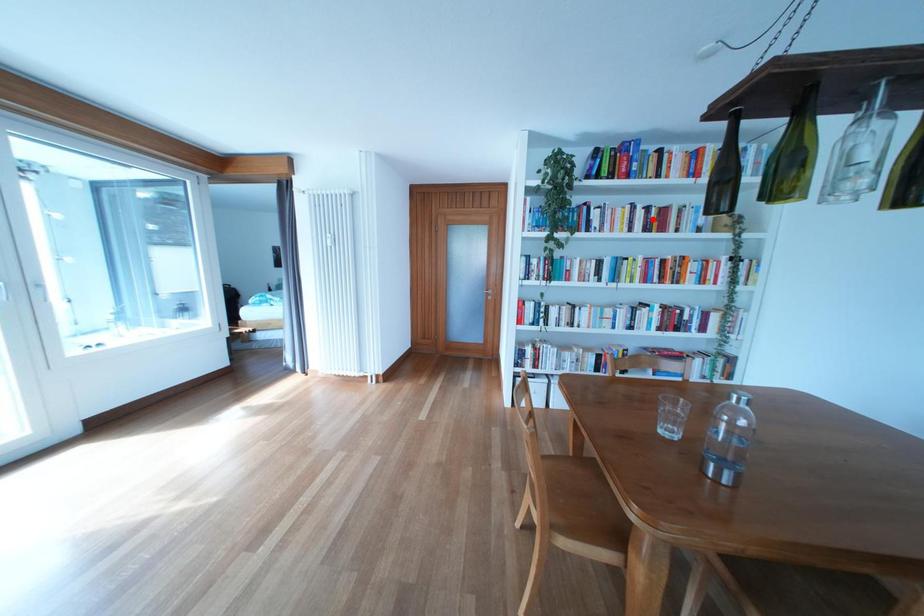
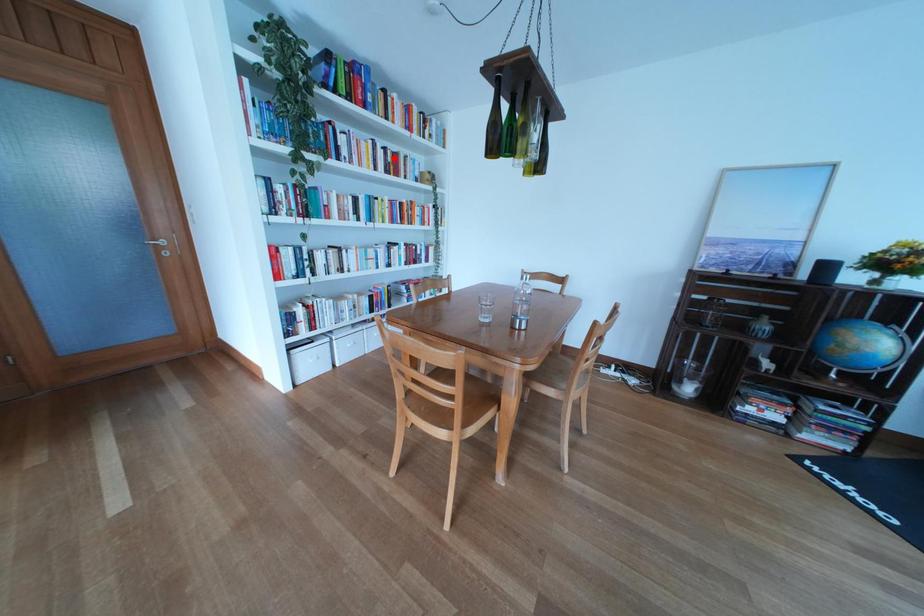
I am providing you with two images of the same scene from different viewpoints. A red point is marked on the first image and another point is marked on the second image. Are the points marked in image1 and image2 representing the same 3D position?

Yes